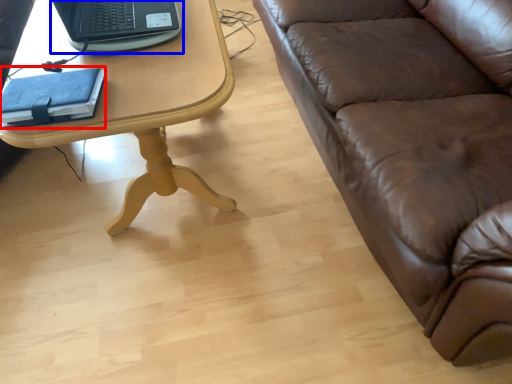
Question: Which of the following is the farthest to the observer, notebook (highlighted by a red box) or laptop (highlighted by a blue box)?

Choices:
 (A) notebook
 (B) laptop

Answer: (B)